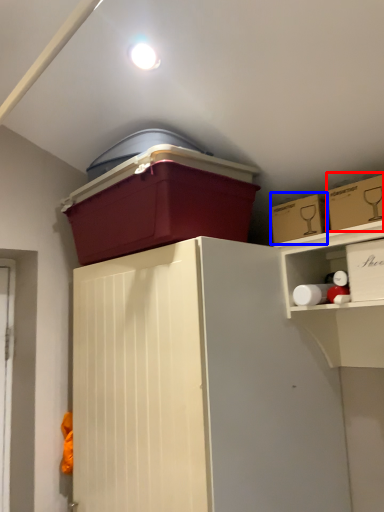
Question: Which object appears closest to the camera in this image, storage box (highlighted by a red box) or storage box (highlighted by a blue box)?

Choices:
 (A) storage box
 (B) storage box

Answer: (A)